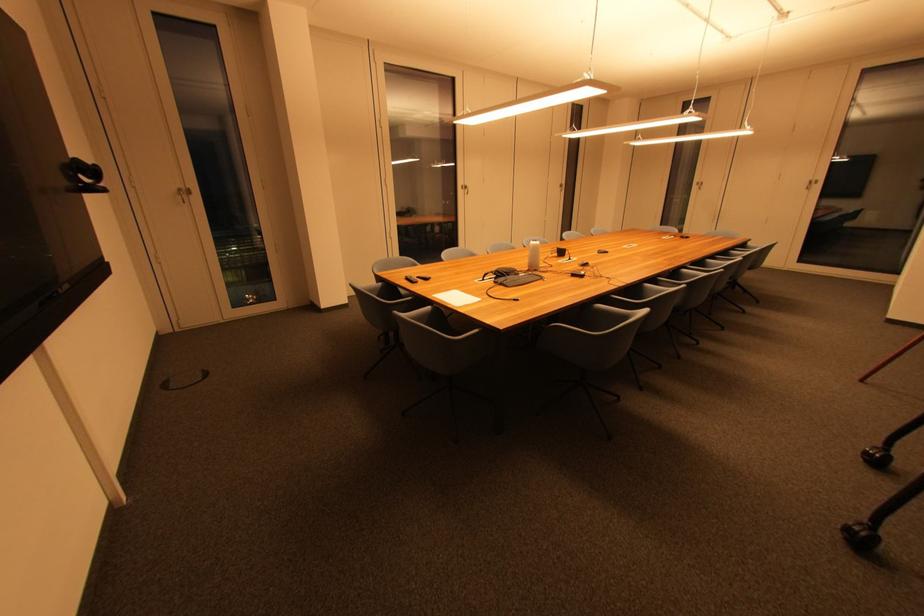
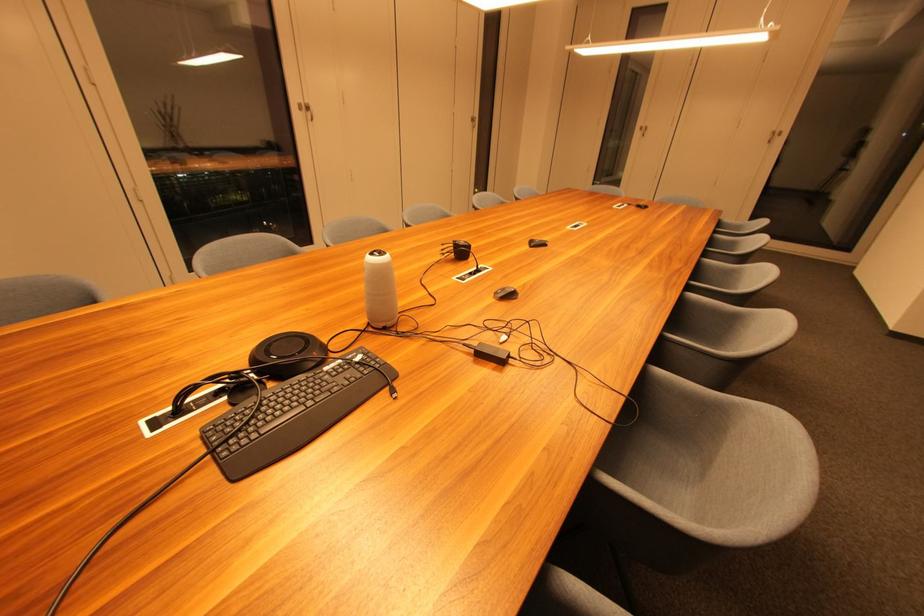
Where in the second image is the point corresponding to (488,282) from the first image?

(185, 414)